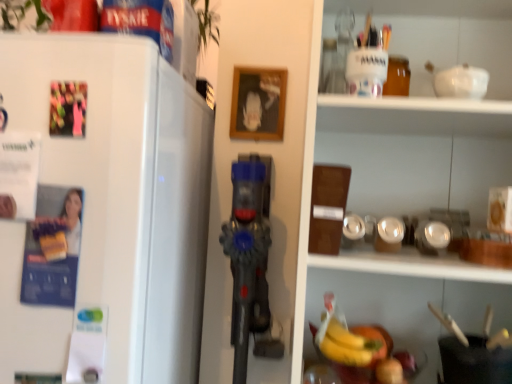
Question: From a real-world perspective, is white matte refrigerator at left positioned above or below yellow matte bananas at lower center?

Choices:
 (A) below
 (B) above

Answer: (B)

Question: Is white matte refrigerator at left wider or thinner than yellow matte bananas at lower center?

Choices:
 (A) wide
 (B) thin

Answer: (A)

Question: From their relative heights in the image, would you say white matte refrigerator at left is taller or shorter than yellow matte bananas at lower center?

Choices:
 (A) tall
 (B) short

Answer: (A)

Question: Choose the correct answer: Is yellow matte bananas at lower center inside white matte refrigerator at left or outside it?

Choices:
 (A) outside
 (B) inside

Answer: (A)

Question: Is yellow matte bananas at lower center taller or shorter than white matte refrigerator at left?

Choices:
 (A) tall
 (B) short

Answer: (B)

Question: Looking at the image, does yellow matte bananas at lower center seem bigger or smaller compared to white matte refrigerator at left?

Choices:
 (A) small
 (B) big

Answer: (A)

Question: Is yellow matte bananas at lower center in front of or behind white matte refrigerator at left in the image?

Choices:
 (A) front
 (B) behind

Answer: (B)